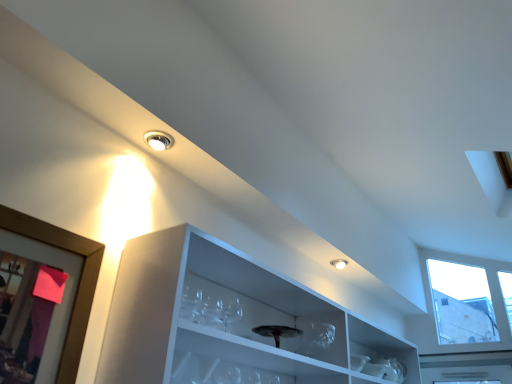
Question: Considering the relative sizes of clear glass wine glass at center and matte white droplight at upper center in the image provided, is clear glass wine glass at center taller than matte white droplight at upper center?

Choices:
 (A) yes
 (B) no

Answer: (A)

Question: Can you confirm if clear glass wine glass at center is wider than matte white droplight at upper center?

Choices:
 (A) no
 (B) yes

Answer: (A)

Question: Is clear glass wine glass at center to the left of matte white droplight at upper center from the viewer's perspective?

Choices:
 (A) no
 (B) yes

Answer: (A)

Question: From the image's perspective, is clear glass wine glass at center below matte white droplight at upper center?

Choices:
 (A) yes
 (B) no

Answer: (A)

Question: From a real-world perspective, is clear glass wine glass at center physically above matte white droplight at upper center?

Choices:
 (A) no
 (B) yes

Answer: (A)

Question: Can you confirm if clear glass wine glass at center is shorter than matte white droplight at upper center?

Choices:
 (A) yes
 (B) no

Answer: (B)

Question: Can you confirm if matte white droplight at upper center is shorter than wooden picture frame at left?

Choices:
 (A) no
 (B) yes

Answer: (B)

Question: Does matte white droplight at upper center have a larger size compared to wooden picture frame at left?

Choices:
 (A) yes
 (B) no

Answer: (B)

Question: Considering the relative sizes of matte white droplight at upper center and wooden picture frame at left in the image provided, is matte white droplight at upper center taller than wooden picture frame at left?

Choices:
 (A) yes
 (B) no

Answer: (B)

Question: Can you confirm if matte white droplight at upper center is smaller than wooden picture frame at left?

Choices:
 (A) no
 (B) yes

Answer: (B)

Question: Would you say wooden picture frame at left is part of matte white droplight at upper center's contents?

Choices:
 (A) yes
 (B) no

Answer: (B)

Question: Are matte white droplight at upper center and wooden picture frame at left beside each other?

Choices:
 (A) no
 (B) yes

Answer: (A)

Question: Is clear glass wine glass at center shorter than wooden picture frame at left?

Choices:
 (A) no
 (B) yes

Answer: (B)